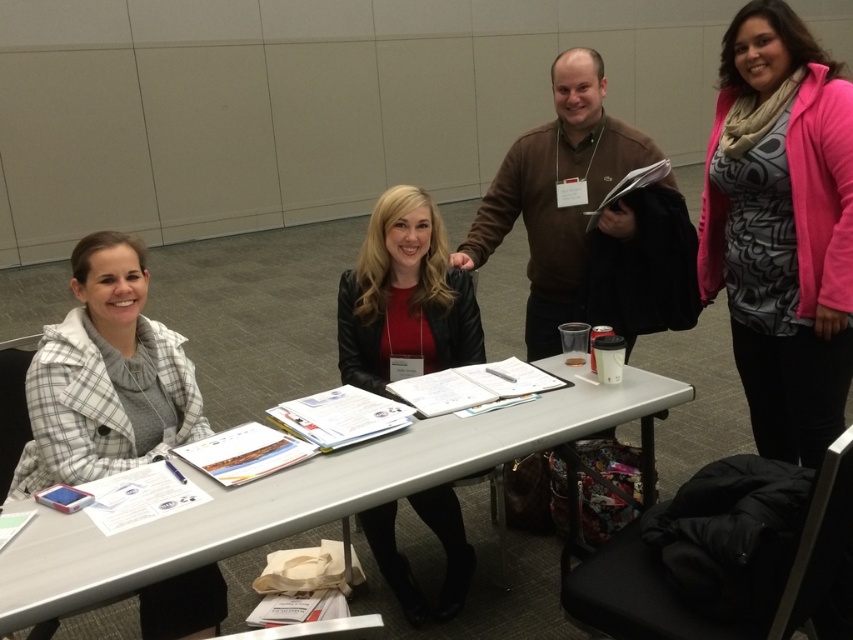
Can you confirm if pink matte cardigan at upper right is thinner than white plaid coat at left?

Yes, pink matte cardigan at upper right is thinner than white plaid coat at left.

Who is more distant from viewer, (775, 305) or (123, 296)?

The point (775, 305) is more distant.

Where is `pink matte cardigan at upper right`? The width and height of the screenshot is (853, 640). pink matte cardigan at upper right is located at coordinates (782, 230).

Who is positioned more to the left, white plastic table at center or leather jacket at center?

Positioned to the left is white plastic table at center.

Identify the location of white plastic table at center. This screenshot has height=640, width=853. (306, 493).

Does point (218, 490) come farther from viewer compared to point (131, 278)?

No.

Does white plastic table at center have a larger size compared to white plaid coat at left?

Indeed, white plastic table at center has a larger size compared to white plaid coat at left.

What are the coordinates of `white plastic table at center` in the screenshot? It's located at (306, 493).

Locate an element on the screen. This screenshot has height=640, width=853. white plastic table at center is located at coordinates (306, 493).